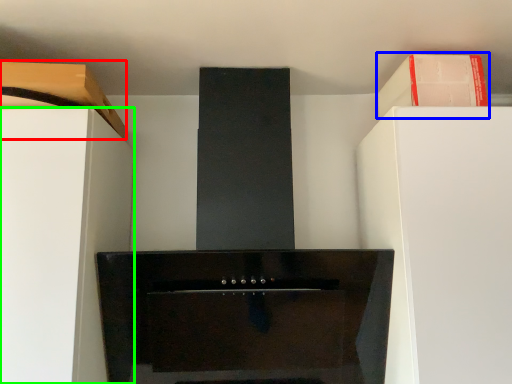
Question: Which object is the closest to the cabinetry (highlighted by a red box)? Choose among these: cabinetry (highlighted by a blue box) or furniture (highlighted by a green box).

Choices:
 (A) cabinetry
 (B) furniture

Answer: (B)